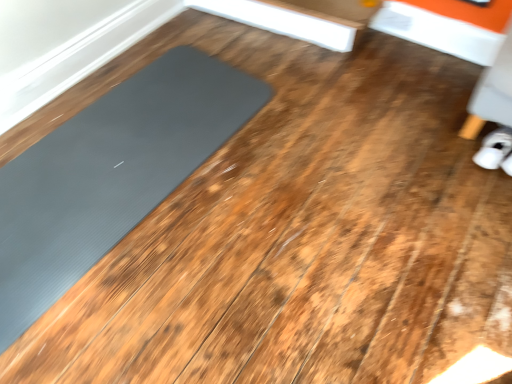
Question: Is gray rubber mat at left inside white fabric shoe at lower right?

Choices:
 (A) yes
 (B) no

Answer: (B)

Question: From a real-world perspective, is white fabric shoe at lower right physically below gray rubber mat at left?

Choices:
 (A) yes
 (B) no

Answer: (B)

Question: Is there a large distance between white fabric shoe at lower right and gray rubber mat at left?

Choices:
 (A) no
 (B) yes

Answer: (B)

Question: Does white fabric shoe at lower right have a greater width compared to gray rubber mat at left?

Choices:
 (A) yes
 (B) no

Answer: (B)

Question: Does white fabric shoe at lower right have a larger size compared to gray rubber mat at left?

Choices:
 (A) yes
 (B) no

Answer: (B)

Question: Is white fabric shoe at lower right oriented away from gray rubber mat at left?

Choices:
 (A) yes
 (B) no

Answer: (B)

Question: Considering the relative positions of gray rubber mat at left and white fabric shoe at lower right in the image provided, is gray rubber mat at left to the left of white fabric shoe at lower right from the viewer's perspective?

Choices:
 (A) no
 (B) yes

Answer: (B)

Question: Can you confirm if gray rubber mat at left is taller than white fabric shoe at lower right?

Choices:
 (A) no
 (B) yes

Answer: (A)

Question: Could white fabric shoe at lower right be considered to be inside gray rubber mat at left?

Choices:
 (A) no
 (B) yes

Answer: (A)

Question: Can you confirm if gray rubber mat at left is shorter than white fabric shoe at lower right?

Choices:
 (A) no
 (B) yes

Answer: (B)

Question: Does gray rubber mat at left have a lesser width compared to white fabric shoe at lower right?

Choices:
 (A) yes
 (B) no

Answer: (B)

Question: From the image's perspective, does gray rubber mat at left appear lower than white fabric shoe at lower right?

Choices:
 (A) yes
 (B) no

Answer: (A)

Question: Based on their positions, is white fabric shoe at lower right located to the left or right of gray rubber mat at left?

Choices:
 (A) right
 (B) left

Answer: (A)